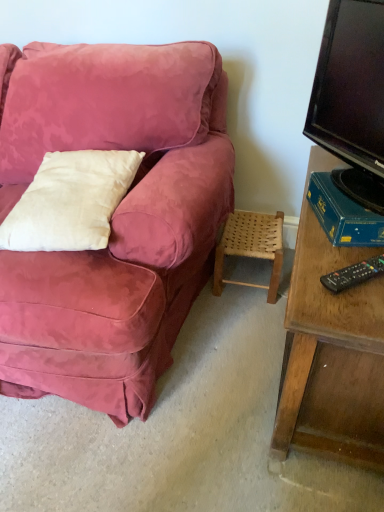
Question: Visually, is white cotton pillow at left positioned to the left or to the right of black plastic remote control at lower right?

Choices:
 (A) left
 (B) right

Answer: (A)

Question: In terms of size, does white cotton pillow at left appear bigger or smaller than black plastic remote control at lower right?

Choices:
 (A) small
 (B) big

Answer: (B)

Question: Which of these objects is positioned farthest from the black plastic remote control at lower right?

Choices:
 (A) white cotton pillow at left
 (B) blue cardboard book at right
 (C) woven wood stool at lower right
 (D) black glossy tv at right

Answer: (C)

Question: Estimate the real-world distances between objects in this image. Which object is closer to the black glossy tv at right?

Choices:
 (A) blue cardboard book at right
 (B) woven wood stool at lower right
 (C) black plastic remote control at lower right
 (D) white cotton pillow at left

Answer: (A)